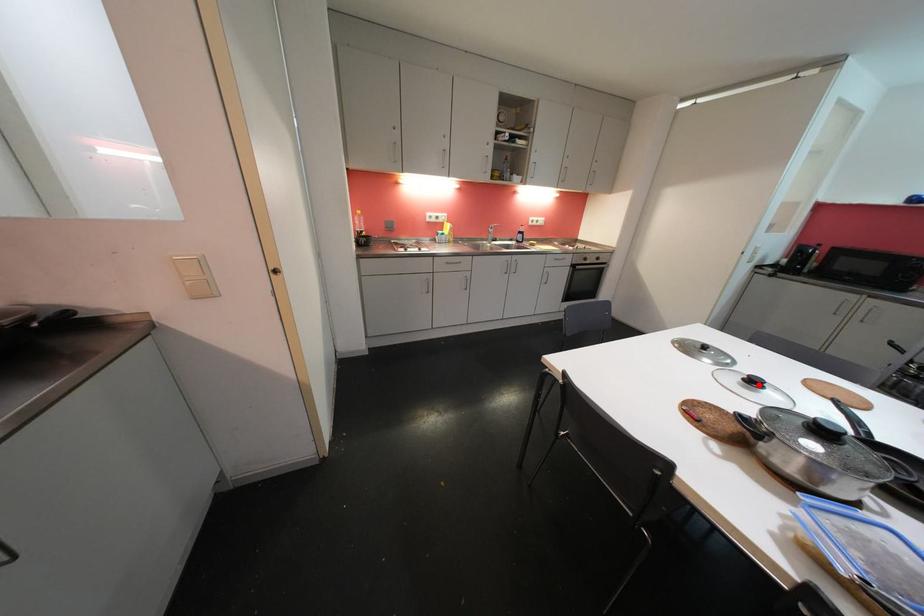
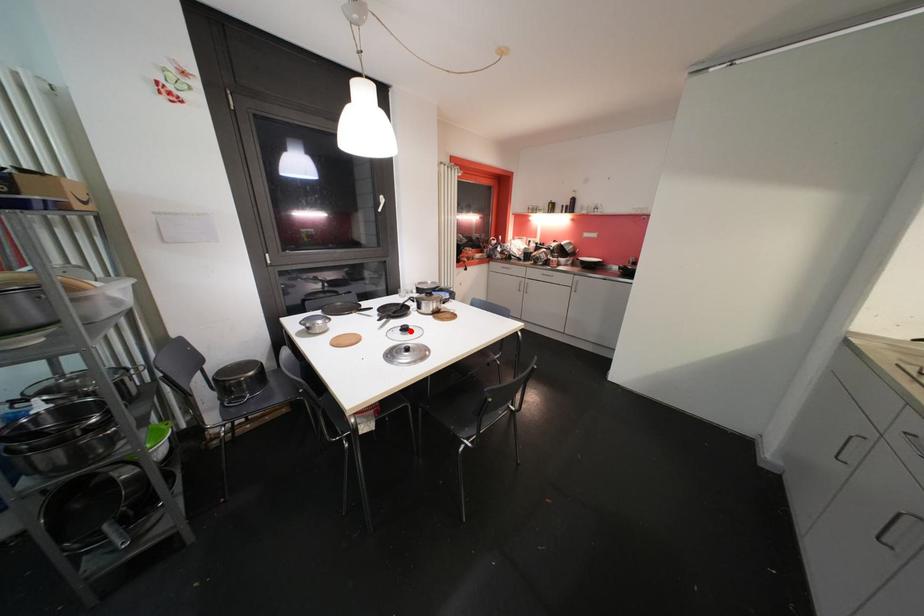
I am providing you with two images of the same scene from different viewpoints. A red point is marked on the first image and another point is marked on the second image. Does the point marked in image1 correspond to the same location as the one in image2?

Yes